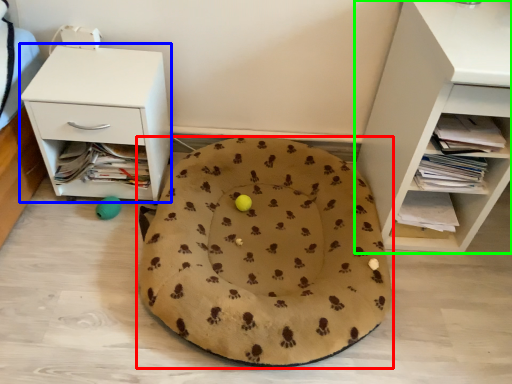
Question: Which object is the farthest from dog bed (highlighted by a red box)? Choose among these: nightstand (highlighted by a blue box) or shelf (highlighted by a green box).

Choices:
 (A) nightstand
 (B) shelf

Answer: (B)